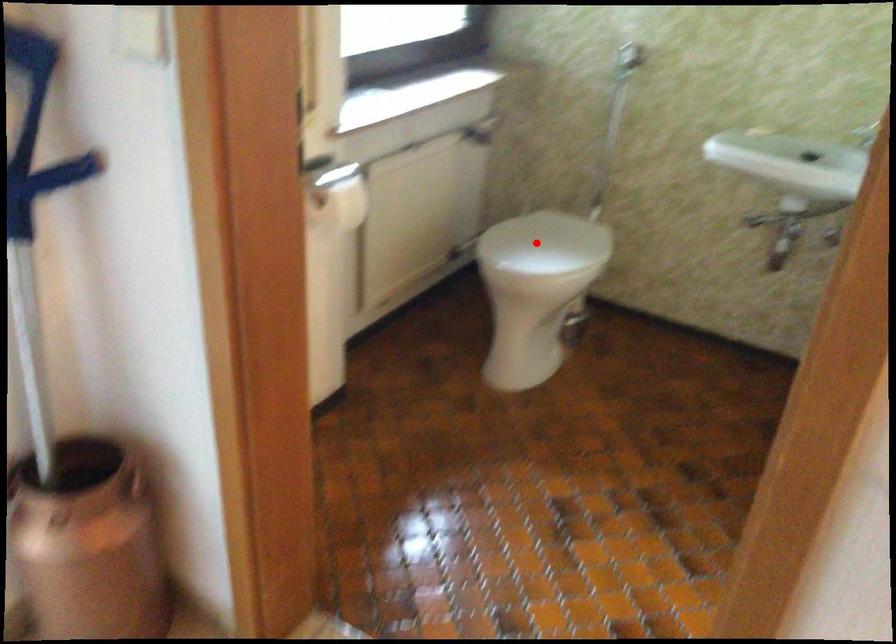
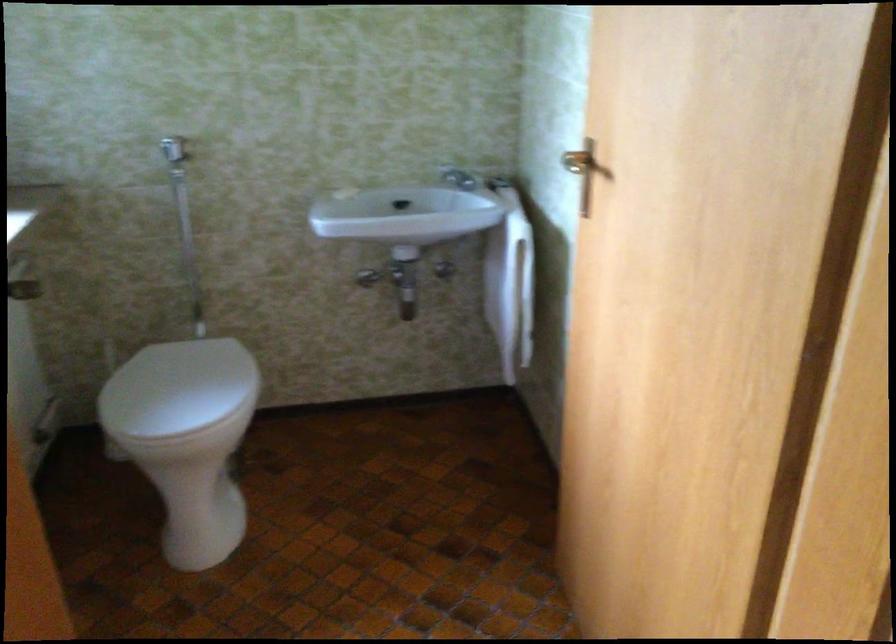
Locate, in the second image, the point that corresponds to the highlighted location in the first image.

(177, 388)